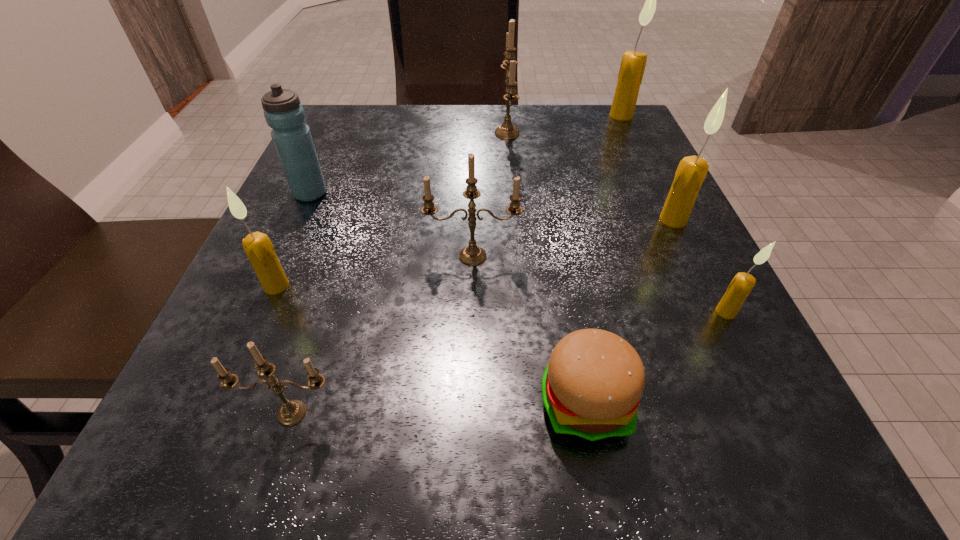
Locate an element on the screen. The width and height of the screenshot is (960, 540). the sixth farthest candle is located at coordinates (742, 284).

I want to click on the seventh farthest object, so click(742, 284).

In order to click on the smallest metallic candle in this screenshot , I will do `click(292, 412)`.

You are a GUI agent. You are given a task and a screenshot of the screen. Output one action in this format:
    pyautogui.click(x=<x>, y=<y>)
    Task: Click on the leftmost metallic candle
    The image size is (960, 540).
    Given the screenshot: What is the action you would take?
    click(292, 412)

Identify the location of the shortest object. This screenshot has width=960, height=540. (592, 386).

This screenshot has width=960, height=540. Find the location of `beige hamburger`. beige hamburger is located at coordinates [592, 386].

Identify the location of vacant space located on the front of the biggest cream candle. The height and width of the screenshot is (540, 960). (643, 161).

The width and height of the screenshot is (960, 540). I want to click on blank space located on the front of the biggest metallic candle, so click(519, 274).

I want to click on vacant space situated 0.320m on the front of the fourth farthest object, so click(762, 403).

The width and height of the screenshot is (960, 540). Identify the location of vacant region located 0.230m on the right of the water bottle. (452, 193).